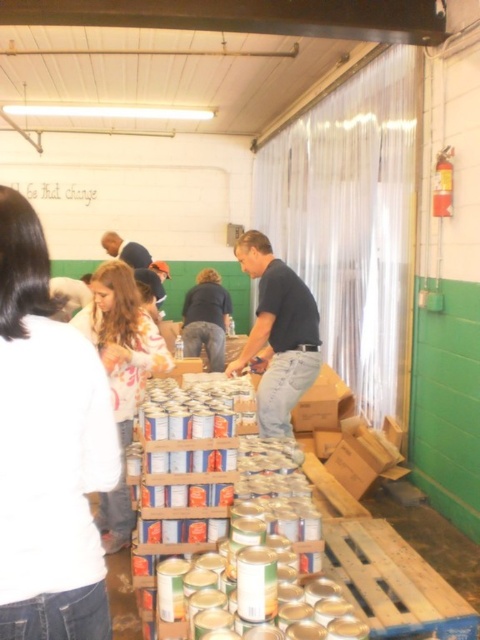
Is white cotton shirt at left to the right of dark blue shirt at center from the viewer's perspective?

Yes, white cotton shirt at left is to the right of dark blue shirt at center.

Is white cotton shirt at left closer to the viewer compared to dark blue shirt at center?

Yes, it is.

Locate an element on the screen. The width and height of the screenshot is (480, 640). white cotton shirt at left is located at coordinates (48, 449).

This screenshot has height=640, width=480. I want to click on white cotton shirt at left, so click(x=48, y=449).

Does white cotton shirt at left appear on the right side of black cotton shirt at center?

Incorrect, white cotton shirt at left is not on the right side of black cotton shirt at center.

Is point (74, 596) less distant than point (276, 339)?

That is True.

Locate an element on the screen. Image resolution: width=480 pixels, height=640 pixels. white cotton shirt at left is located at coordinates (48, 449).

Based on the photo, can you confirm if black cotton shirt at center is positioned to the right of dark blue shirt at center?

Indeed, black cotton shirt at center is positioned on the right side of dark blue shirt at center.

Does black cotton shirt at center have a greater height compared to dark blue shirt at center?

Yes, black cotton shirt at center is taller than dark blue shirt at center.

Is point (263, 369) positioned behind point (220, 312)?

No, it is in front of (220, 312).

The height and width of the screenshot is (640, 480). In order to click on black cotton shirt at center in this screenshot , I will do `click(277, 336)`.